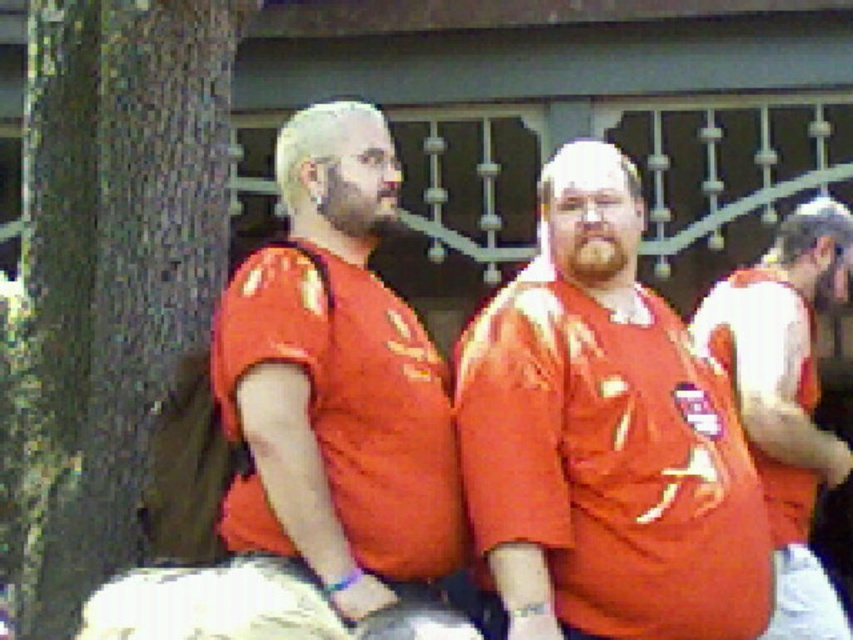
Question: Does matte orange shirt at left have a smaller size compared to brown rough bark at left?

Choices:
 (A) no
 (B) yes

Answer: (A)

Question: Which point is closer to the camera?

Choices:
 (A) (723, 285)
 (B) (637, 433)

Answer: (B)

Question: Does matte orange shirt at left have a larger size compared to brown rough bark at left?

Choices:
 (A) yes
 (B) no

Answer: (A)

Question: Which of these objects is positioned farthest from the brown rough bark at left?

Choices:
 (A) matte orange shirt at left
 (B) matte orange shirt at center
 (C) matte orange t-shirt at center

Answer: (B)

Question: Is matte orange t-shirt at center bigger than brown rough bark at left?

Choices:
 (A) yes
 (B) no

Answer: (A)

Question: Which point is farther to the camera?

Choices:
 (A) (x=541, y=349)
 (B) (x=409, y=378)

Answer: (A)